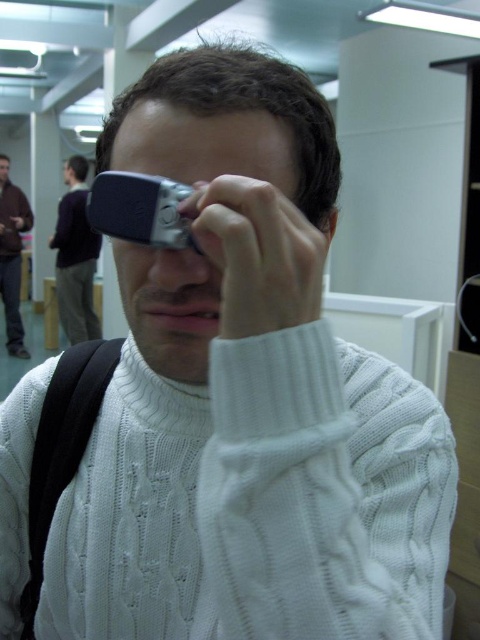
Is dark purple sweater at upper left to the right of brown leather jacket at left from the viewer's perspective?

Correct, you'll find dark purple sweater at upper left to the right of brown leather jacket at left.

Can you confirm if dark purple sweater at upper left is positioned below brown leather jacket at left?

Yes.

Where is `dark purple sweater at upper left`? This screenshot has height=640, width=480. dark purple sweater at upper left is located at coordinates (75, 257).